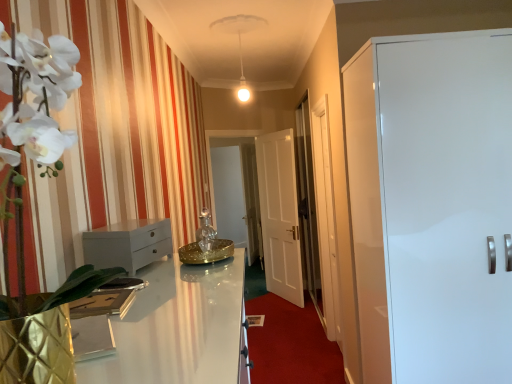
Question: Is white glossy cabinet at right, the 2th door in the left-to-right sequence, situated inside white fabric curtain at left or outside?

Choices:
 (A) inside
 (B) outside

Answer: (B)

Question: From the image's perspective, is white glossy cabinet at right, which is counted as the 1th door, starting from the front, located above or below white fabric curtain at left?

Choices:
 (A) below
 (B) above

Answer: (A)

Question: Which object is the farthest from the white glossy cabinet at right, the 2th door in the left-to-right sequence?

Choices:
 (A) white glossy chest of drawers at left
 (B) transparent glass door at center, the 1th glass door in the back-to-front sequence
 (C) transparent glass door at center, the 2th glass door from the back
 (D) white glossy door at center, placed as the first door when sorted from left to right
 (E) white fabric curtain at left

Answer: (B)

Question: Which of these objects is positioned farthest from the white fabric curtain at left?

Choices:
 (A) white glossy chest of drawers at left
 (B) white glossy cabinet at right, placed as the second door when sorted from back to front
 (C) transparent glass door at center, positioned as the 1th glass door in right-to-left order
 (D) transparent glass door at center, the second glass door viewed from the front
 (E) white glossy door at center, placed as the first door when sorted from left to right

Answer: (D)